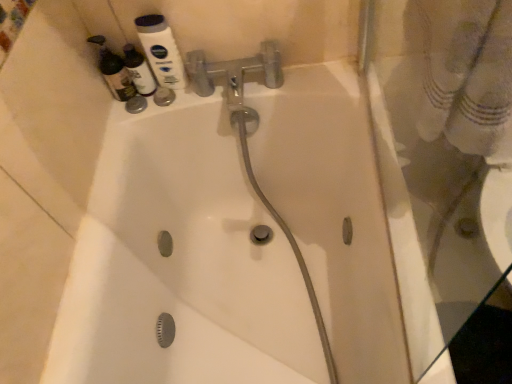
In order to click on matte white bottle at upper left, arranged as the second cleaning product when viewed from the left in this screenshot , I will do `click(139, 71)`.

In order to click on matte white bottle at upper left, the second cleaning product when ordered from right to left in this screenshot , I will do `click(114, 71)`.

Which of these two, matte white bottle at upper left, arranged as the second cleaning product when viewed from the left, or white glossy mouthwash at upper left, is wider?

matte white bottle at upper left, arranged as the second cleaning product when viewed from the left.

From a real-world perspective, relative to white glossy mouthwash at upper left, is matte white bottle at upper left, which appears as the first cleaning product when viewed from the right, vertically above or below?

matte white bottle at upper left, which appears as the first cleaning product when viewed from the right, is below white glossy mouthwash at upper left.

From the picture: From the image's perspective, would you say matte white bottle at upper left, which appears as the first cleaning product when viewed from the right, is shown under white glossy mouthwash at upper left?

Yes.

Which is closer, (132, 75) or (143, 47)?

Point (132, 75).

Which object is further away from the camera taking this photo, matte white bottle at upper left, placed as the 1th cleaning product when sorted from left to right, or white glossy mouthwash at upper left?

matte white bottle at upper left, placed as the 1th cleaning product when sorted from left to right, is further away from the camera.

Does matte white bottle at upper left, the second cleaning product when ordered from right to left, have a smaller size compared to white glossy mouthwash at upper left?

No, matte white bottle at upper left, the second cleaning product when ordered from right to left, is not smaller than white glossy mouthwash at upper left.

Where is `cleaning product that is the 1st object located behind the white glossy mouthwash at upper left`? The height and width of the screenshot is (384, 512). cleaning product that is the 1st object located behind the white glossy mouthwash at upper left is located at coordinates (114, 71).

Are matte white bottle at upper left, placed as the 1th cleaning product when sorted from left to right, and white glossy mouthwash at upper left located far from each other?

No, there isn't a large distance between matte white bottle at upper left, placed as the 1th cleaning product when sorted from left to right, and white glossy mouthwash at upper left.

Considering the relative sizes of matte white bottle at upper left, the second cleaning product when ordered from right to left, and matte white bottle at upper left, which appears as the first cleaning product when viewed from the right, in the image provided, is matte white bottle at upper left, the second cleaning product when ordered from right to left, wider than matte white bottle at upper left, which appears as the first cleaning product when viewed from the right,?

Correct, the width of matte white bottle at upper left, the second cleaning product when ordered from right to left, exceeds that of matte white bottle at upper left, which appears as the first cleaning product when viewed from the right.

Is point (129, 82) positioned before point (149, 86)?

Yes, it is in front of point (149, 86).

In the scene shown: Which object is positioned more to the left, matte white bottle at upper left, the second cleaning product when ordered from right to left, or matte white bottle at upper left, which appears as the first cleaning product when viewed from the right?

matte white bottle at upper left, the second cleaning product when ordered from right to left, is more to the left.

Which is less distant, (147, 92) or (122, 101)?

Point (147, 92).

Does matte white bottle at upper left, arranged as the second cleaning product when viewed from the left, have a lesser height compared to matte white bottle at upper left, placed as the 1th cleaning product when sorted from left to right?

Yes, matte white bottle at upper left, arranged as the second cleaning product when viewed from the left, is shorter than matte white bottle at upper left, placed as the 1th cleaning product when sorted from left to right.

From a real-world perspective, is matte white bottle at upper left, arranged as the second cleaning product when viewed from the left, physically located above or below matte white bottle at upper left, the second cleaning product when ordered from right to left?

From a real-world perspective, matte white bottle at upper left, arranged as the second cleaning product when viewed from the left, is physically below matte white bottle at upper left, the second cleaning product when ordered from right to left.

Considering the relative positions of matte white bottle at upper left, which appears as the first cleaning product when viewed from the right, and matte white bottle at upper left, the second cleaning product when ordered from right to left, in the image provided, is matte white bottle at upper left, which appears as the first cleaning product when viewed from the right, in front of matte white bottle at upper left, the second cleaning product when ordered from right to left,?

No, the depth of matte white bottle at upper left, which appears as the first cleaning product when viewed from the right, is greater than that of matte white bottle at upper left, the second cleaning product when ordered from right to left.

Is white glossy mouthwash at upper left touching matte white bottle at upper left, placed as the 1th cleaning product when sorted from left to right?

white glossy mouthwash at upper left and matte white bottle at upper left, placed as the 1th cleaning product when sorted from left to right, are not in contact.

Could you tell me if white glossy mouthwash at upper left is turned towards matte white bottle at upper left, placed as the 1th cleaning product when sorted from left to right?

No, white glossy mouthwash at upper left is not oriented towards matte white bottle at upper left, placed as the 1th cleaning product when sorted from left to right.

Is white glossy mouthwash at upper left taller than matte white bottle at upper left, the second cleaning product when ordered from right to left?

Correct, white glossy mouthwash at upper left is much taller as matte white bottle at upper left, the second cleaning product when ordered from right to left.

Can you confirm if white glossy mouthwash at upper left is shorter than matte white bottle at upper left, arranged as the second cleaning product when viewed from the left?

In fact, white glossy mouthwash at upper left may be taller than matte white bottle at upper left, arranged as the second cleaning product when viewed from the left.

Is white glossy mouthwash at upper left smaller than matte white bottle at upper left, arranged as the second cleaning product when viewed from the left?

No, white glossy mouthwash at upper left is not smaller than matte white bottle at upper left, arranged as the second cleaning product when viewed from the left.

From the image's perspective, is white glossy mouthwash at upper left on matte white bottle at upper left, arranged as the second cleaning product when viewed from the left?

Yes, from the image's perspective, white glossy mouthwash at upper left is over matte white bottle at upper left, arranged as the second cleaning product when viewed from the left.

Is white glossy mouthwash at upper left thinner than matte white bottle at upper left, which appears as the first cleaning product when viewed from the right?

Correct, the width of white glossy mouthwash at upper left is less than that of matte white bottle at upper left, which appears as the first cleaning product when viewed from the right.

Identify the location of the 1st cleaning product to the left of the white glossy mouthwash at upper left, starting your count from the anchor. Image resolution: width=512 pixels, height=384 pixels. (139, 71).

There is a matte white bottle at upper left, placed as the 1th cleaning product when sorted from left to right. Where is `mouthwash above it (from a real-world perspective)`? mouthwash above it (from a real-world perspective) is located at coordinates (161, 51).

Considering their positions, is white glossy mouthwash at upper left positioned closer to matte white bottle at upper left, the second cleaning product when ordered from right to left, than matte white bottle at upper left, arranged as the second cleaning product when viewed from the left?

matte white bottle at upper left, arranged as the second cleaning product when viewed from the left, is closer to matte white bottle at upper left, the second cleaning product when ordered from right to left.

When comparing their distances from matte white bottle at upper left, which appears as the first cleaning product when viewed from the right, does white glossy mouthwash at upper left or matte white bottle at upper left, the second cleaning product when ordered from right to left, seem closer?

Among the two, matte white bottle at upper left, the second cleaning product when ordered from right to left, is located nearer to matte white bottle at upper left, which appears as the first cleaning product when viewed from the right.

Considering their positions, is matte white bottle at upper left, which appears as the first cleaning product when viewed from the right, positioned further to white glossy mouthwash at upper left than matte white bottle at upper left, placed as the 1th cleaning product when sorted from left to right?

matte white bottle at upper left, placed as the 1th cleaning product when sorted from left to right, is positioned further to the anchor white glossy mouthwash at upper left.

When comparing their distances from white glossy mouthwash at upper left, does matte white bottle at upper left, placed as the 1th cleaning product when sorted from left to right, or matte white bottle at upper left, arranged as the second cleaning product when viewed from the left, seem further?

The object further to white glossy mouthwash at upper left is matte white bottle at upper left, placed as the 1th cleaning product when sorted from left to right.

Estimate the real-world distances between objects in this image. Which object is closer to matte white bottle at upper left, placed as the 1th cleaning product when sorted from left to right, matte white bottle at upper left, which appears as the first cleaning product when viewed from the right, or white glossy mouthwash at upper left?

matte white bottle at upper left, which appears as the first cleaning product when viewed from the right, is positioned closer to the anchor matte white bottle at upper left, placed as the 1th cleaning product when sorted from left to right.

Considering their positions, is matte white bottle at upper left, the second cleaning product when ordered from right to left, positioned closer to matte white bottle at upper left, arranged as the second cleaning product when viewed from the left, than white glossy mouthwash at upper left?

Among the two, matte white bottle at upper left, the second cleaning product when ordered from right to left, is located nearer to matte white bottle at upper left, arranged as the second cleaning product when viewed from the left.

Identify the location of cleaning product situated between matte white bottle at upper left, placed as the 1th cleaning product when sorted from left to right, and white glossy mouthwash at upper left from left to right. The width and height of the screenshot is (512, 384). (139, 71).